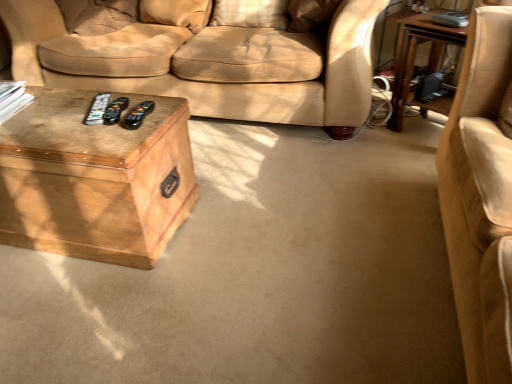
At what (x,y) coordinates should I click in order to perform the action: click on free space in front of wooden table at right, the second table when ordered from left to right. Please return your answer as a coordinate pair (x, y). The height and width of the screenshot is (384, 512). Looking at the image, I should click on (418, 153).